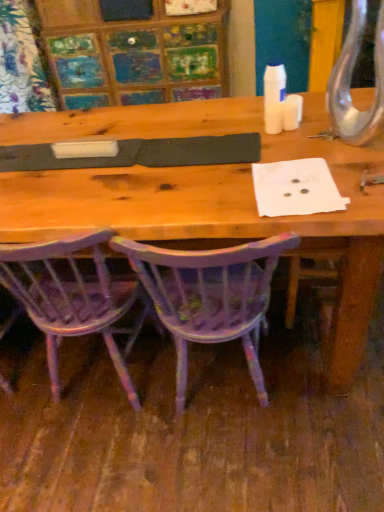
The height and width of the screenshot is (512, 384). I want to click on purple painted wood chair at lower center, marked as the 2th chair in a right-to-left arrangement, so click(x=75, y=297).

The image size is (384, 512). What do you see at coordinates (75, 297) in the screenshot?
I see `purple painted wood chair at lower center, marked as the 2th chair in a right-to-left arrangement` at bounding box center [75, 297].

The image size is (384, 512). Describe the element at coordinates (210, 296) in the screenshot. I see `purple painted wood chair at center, which is the 2th chair in left-to-right order` at that location.

How much space does purple painted wood chair at center, which is the 2th chair in left-to-right order, occupy horizontally?

purple painted wood chair at center, which is the 2th chair in left-to-right order, is 18.84 inches in width.

In order to face purple painted wood chair at center, arranged as the 1th chair when viewed from the right, should I rotate leftwards or rightwards?

To face it directly, rotate right by 3.048 degrees.

Locate an element on the screen. The width and height of the screenshot is (384, 512). purple painted wood chair at center, which is the 2th chair in left-to-right order is located at coordinates (210, 296).

What is the approximate height of purple painted wood chair at center, which is the 2th chair in left-to-right order?

purple painted wood chair at center, which is the 2th chair in left-to-right order, is 31.80 inches tall.

Locate an element on the screen. This screenshot has height=512, width=384. purple painted wood chair at lower center, acting as the first chair starting from the left is located at coordinates (75, 297).

Is purple painted wood chair at lower center, acting as the first chair starting from the left, at the left side of purple painted wood chair at center, arranged as the 1th chair when viewed from the right?

Yes.

Which object is further away from the camera, purple painted wood chair at lower center, acting as the first chair starting from the left, or purple painted wood chair at center, which is the 2th chair in left-to-right order?

purple painted wood chair at lower center, acting as the first chair starting from the left, is behind.

Which point is more forward, (x=74, y=305) or (x=167, y=306)?

Point (x=167, y=306)

From the image's perspective, relative to purple painted wood chair at center, arranged as the 1th chair when viewed from the right, is purple painted wood chair at lower center, marked as the 2th chair in a right-to-left arrangement, above or below?

Clearly, from the image's perspective, purple painted wood chair at lower center, marked as the 2th chair in a right-to-left arrangement, is above purple painted wood chair at center, arranged as the 1th chair when viewed from the right.

From a real-world perspective, is purple painted wood chair at lower center, marked as the 2th chair in a right-to-left arrangement, over purple painted wood chair at center, arranged as the 1th chair when viewed from the right?

Correct, in the physical world, purple painted wood chair at lower center, marked as the 2th chair in a right-to-left arrangement, is higher than purple painted wood chair at center, arranged as the 1th chair when viewed from the right.

Which of these two, purple painted wood chair at lower center, marked as the 2th chair in a right-to-left arrangement, or purple painted wood chair at center, arranged as the 1th chair when viewed from the right, is wider?

With larger width is purple painted wood chair at center, arranged as the 1th chair when viewed from the right.

Which of these two, purple painted wood chair at lower center, marked as the 2th chair in a right-to-left arrangement, or purple painted wood chair at center, arranged as the 1th chair when viewed from the right, stands taller?

With more height is purple painted wood chair at lower center, marked as the 2th chair in a right-to-left arrangement.

Does purple painted wood chair at lower center, marked as the 2th chair in a right-to-left arrangement, have a smaller size compared to purple painted wood chair at center, which is the 2th chair in left-to-right order?

Yes, purple painted wood chair at lower center, marked as the 2th chair in a right-to-left arrangement, is smaller than purple painted wood chair at center, which is the 2th chair in left-to-right order.

Is purple painted wood chair at lower center, acting as the first chair starting from the left, surrounding purple painted wood chair at center, which is the 2th chair in left-to-right order?

Actually, purple painted wood chair at center, which is the 2th chair in left-to-right order, is outside purple painted wood chair at lower center, acting as the first chair starting from the left.

Is purple painted wood chair at lower center, acting as the first chair starting from the left, next to purple painted wood chair at center, which is the 2th chair in left-to-right order?

No, purple painted wood chair at lower center, acting as the first chair starting from the left, is not next to purple painted wood chair at center, which is the 2th chair in left-to-right order.

Is purple painted wood chair at lower center, acting as the first chair starting from the left, positioned with its back to purple painted wood chair at center, which is the 2th chair in left-to-right order?

No, purple painted wood chair at lower center, acting as the first chair starting from the left, is not facing the opposite direction of purple painted wood chair at center, which is the 2th chair in left-to-right order.

Could you measure the distance between purple painted wood chair at lower center, marked as the 2th chair in a right-to-left arrangement, and purple painted wood chair at center, arranged as the 1th chair when viewed from the right?

purple painted wood chair at lower center, marked as the 2th chair in a right-to-left arrangement, is 10.30 inches away from purple painted wood chair at center, arranged as the 1th chair when viewed from the right.

Find the location of `chair below the purple painted wood chair at lower center, acting as the first chair starting from the left (from the image's perspective)`. chair below the purple painted wood chair at lower center, acting as the first chair starting from the left (from the image's perspective) is located at coordinates (210, 296).

Considering the relative positions of purple painted wood chair at center, arranged as the 1th chair when viewed from the right, and purple painted wood chair at lower center, acting as the first chair starting from the left, in the image provided, is purple painted wood chair at center, arranged as the 1th chair when viewed from the right, to the left or to the right of purple painted wood chair at lower center, acting as the first chair starting from the left,?

In the image, purple painted wood chair at center, arranged as the 1th chair when viewed from the right, appears on the right side of purple painted wood chair at lower center, acting as the first chair starting from the left.

Considering their positions, is purple painted wood chair at center, which is the 2th chair in left-to-right order, located in front of or behind purple painted wood chair at lower center, marked as the 2th chair in a right-to-left arrangement?

In the image, purple painted wood chair at center, which is the 2th chair in left-to-right order, appears in front of purple painted wood chair at lower center, marked as the 2th chair in a right-to-left arrangement.

Which is in front, point (203, 261) or point (88, 321)?

The point (203, 261) is closer.

From the image's perspective, is purple painted wood chair at center, which is the 2th chair in left-to-right order, positioned above or below purple painted wood chair at lower center, acting as the first chair starting from the left?

From the image's perspective, purple painted wood chair at center, which is the 2th chair in left-to-right order, appears below purple painted wood chair at lower center, acting as the first chair starting from the left.

Based on the photo, from a real-world perspective, who is located lower, purple painted wood chair at center, which is the 2th chair in left-to-right order, or purple painted wood chair at lower center, acting as the first chair starting from the left?

purple painted wood chair at center, which is the 2th chair in left-to-right order.

Which of these two, purple painted wood chair at center, which is the 2th chair in left-to-right order, or purple painted wood chair at lower center, acting as the first chair starting from the left, is thinner?

purple painted wood chair at lower center, acting as the first chair starting from the left.

Does purple painted wood chair at center, arranged as the 1th chair when viewed from the right, have a lesser height compared to purple painted wood chair at lower center, marked as the 2th chair in a right-to-left arrangement?

Yes, purple painted wood chair at center, arranged as the 1th chair when viewed from the right, is shorter than purple painted wood chair at lower center, marked as the 2th chair in a right-to-left arrangement.

Which of these two, purple painted wood chair at center, which is the 2th chair in left-to-right order, or purple painted wood chair at lower center, acting as the first chair starting from the left, is bigger?

purple painted wood chair at center, which is the 2th chair in left-to-right order, is bigger.

Does purple painted wood chair at center, which is the 2th chair in left-to-right order, contain purple painted wood chair at lower center, acting as the first chair starting from the left?

No, purple painted wood chair at lower center, acting as the first chair starting from the left, is located outside of purple painted wood chair at center, which is the 2th chair in left-to-right order.

Are purple painted wood chair at center, arranged as the 1th chair when viewed from the right, and purple painted wood chair at lower center, marked as the 2th chair in a right-to-left arrangement, beside each other?

No, purple painted wood chair at center, arranged as the 1th chair when viewed from the right, is not making contact with purple painted wood chair at lower center, marked as the 2th chair in a right-to-left arrangement.

Is purple painted wood chair at center, which is the 2th chair in left-to-right order, turned away from purple painted wood chair at lower center, acting as the first chair starting from the left?

No.

Can you tell me how much purple painted wood chair at center, arranged as the 1th chair when viewed from the right, and purple painted wood chair at lower center, marked as the 2th chair in a right-to-left arrangement, differ in facing direction?

1.33 degrees separate the facing orientations of purple painted wood chair at center, arranged as the 1th chair when viewed from the right, and purple painted wood chair at lower center, marked as the 2th chair in a right-to-left arrangement.

Measure the distance between purple painted wood chair at center, which is the 2th chair in left-to-right order, and purple painted wood chair at lower center, marked as the 2th chair in a right-to-left arrangement.

purple painted wood chair at center, which is the 2th chair in left-to-right order, and purple painted wood chair at lower center, marked as the 2th chair in a right-to-left arrangement, are 10.30 inches apart.

Identify the location of chair beneath the purple painted wood chair at lower center, acting as the first chair starting from the left (from a real-world perspective). (210, 296).

Identify the location of chair below the purple painted wood chair at lower center, acting as the first chair starting from the left (from the image's perspective). This screenshot has height=512, width=384. (210, 296).

What are the coordinates of `chair below the purple painted wood chair at lower center, marked as the 2th chair in a right-to-left arrangement (from a real-world perspective)` in the screenshot? It's located at (210, 296).